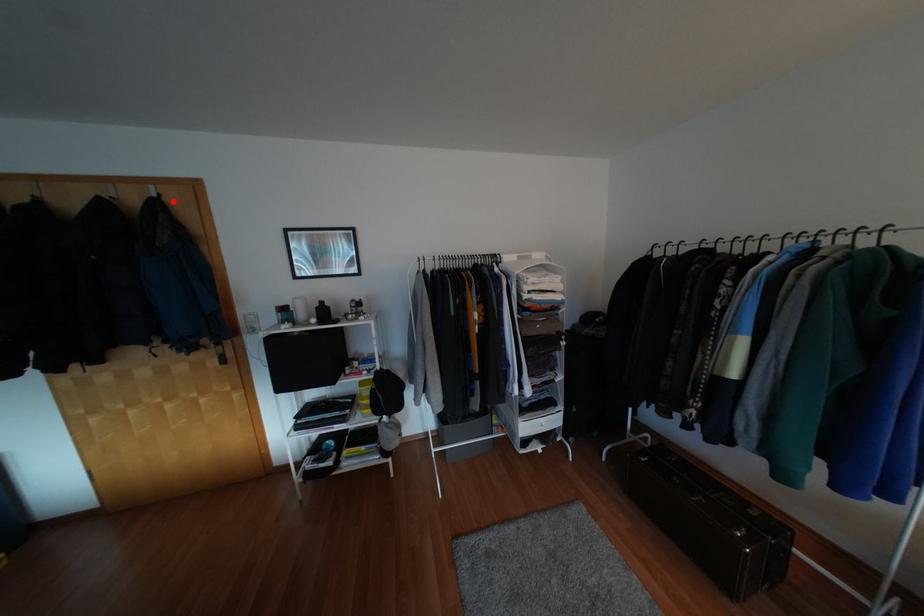
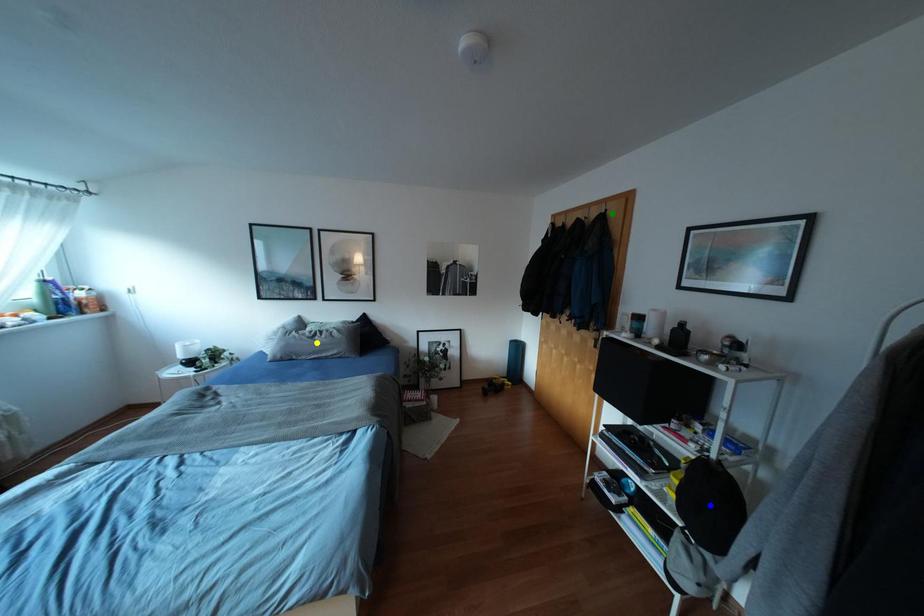
Question: I am providing you with two images of the same scene from different viewpoints. A red point is marked on the first image. You are given multiple points on the second image. Which mark in image 2 goes with the point in image 1?

Choices:
 (A) green point
 (B) yellow point
 (C) blue point

Answer: (A)